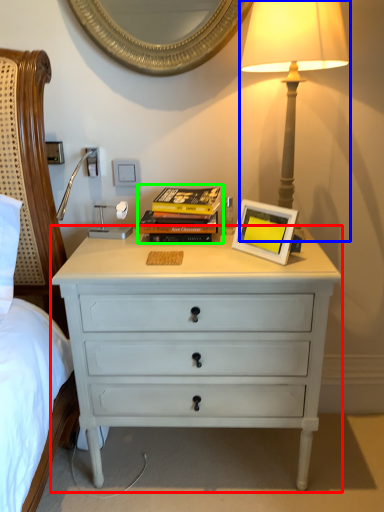
Question: Which is nearer to the chest of drawers (highlighted by a red box)? bedside lamp (highlighted by a blue box) or magazine (highlighted by a green box).

Choices:
 (A) bedside lamp
 (B) magazine

Answer: (B)